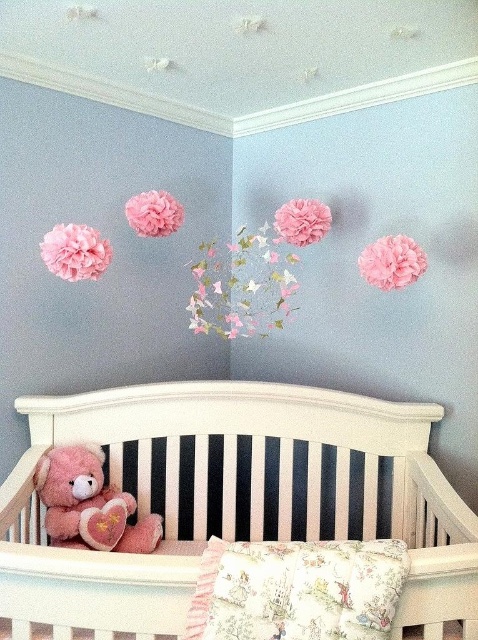
Who is shorter, matte pink pom-pom at upper left or pink fabric flower at upper center?

Standing shorter between the two is matte pink pom-pom at upper left.

Who is more distant from viewer, (60, 234) or (153, 192)?

The point (153, 192) is behind.

Image resolution: width=478 pixels, height=640 pixels. Find the location of `matte pink pom-pom at upper left`. matte pink pom-pom at upper left is located at coordinates (75, 252).

From the picture: Who is taller, pink paper flower at center or pink fabric flower at upper center?

Standing taller between the two is pink paper flower at center.

Can you confirm if pink paper flower at center is positioned to the left of pink fabric flower at upper center?

No, pink paper flower at center is not to the left of pink fabric flower at upper center.

What do you see at coordinates (241, 285) in the screenshot? I see `pink paper flower at center` at bounding box center [241, 285].

This screenshot has height=640, width=478. Identify the location of pink paper flower at center. (241, 285).

Identify the location of matte pink pom-pom at upper left. The width and height of the screenshot is (478, 640). (75, 252).

Can you confirm if matte pink pom-pom at upper left is positioned above matte pink pom-pom at upper center?

Actually, matte pink pom-pom at upper left is below matte pink pom-pom at upper center.

Which is behind, point (71, 244) or point (321, 218)?

The point (321, 218) is behind.

The width and height of the screenshot is (478, 640). I want to click on matte pink pom-pom at upper left, so click(x=75, y=252).